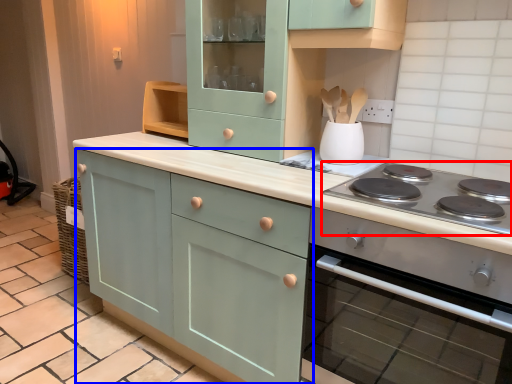
Question: Which object appears farthest to the camera in this image, gas stove (highlighted by a red box) or cabinetry (highlighted by a blue box)?

Choices:
 (A) gas stove
 (B) cabinetry

Answer: (B)